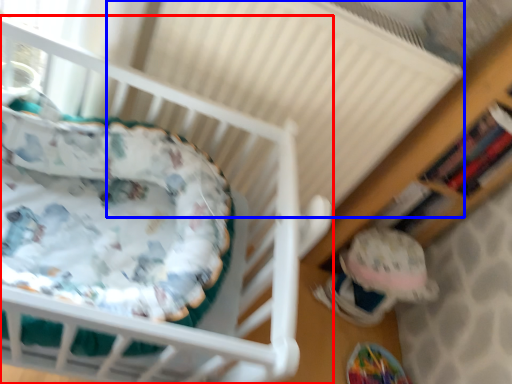
Question: Which object is closer to the camera taking this photo, infant bed (highlighted by a red box) or radiator (highlighted by a blue box)?

Choices:
 (A) infant bed
 (B) radiator

Answer: (A)